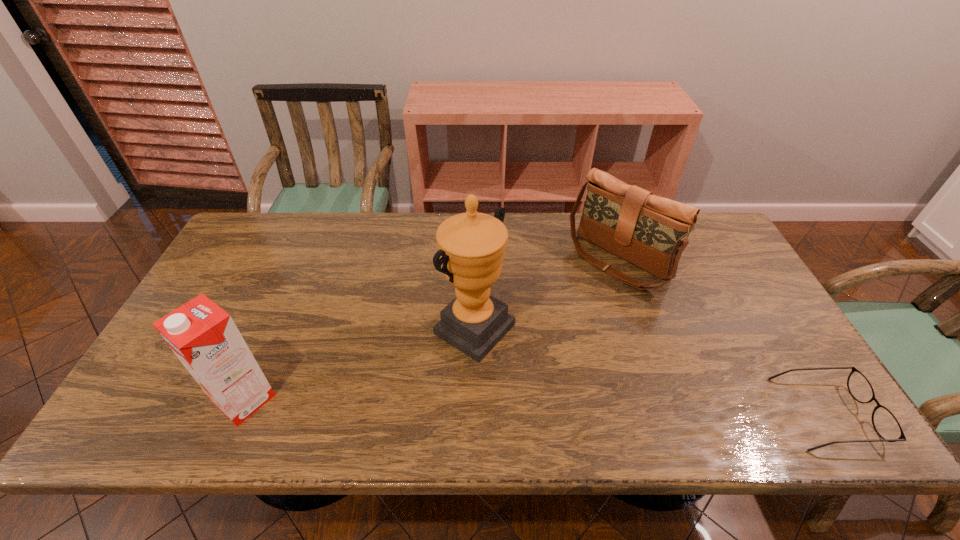
At what (x,y) coordinates should I click in order to perform the action: click on vacant space at the far edge of the desktop. Please return your answer as a coordinate pair (x, y). Image resolution: width=960 pixels, height=540 pixels. Looking at the image, I should click on (538, 246).

Locate an element on the screen. free space at the near edge of the desktop is located at coordinates (345, 375).

Locate an element on the screen. This screenshot has width=960, height=540. free space at the left edge of the desktop is located at coordinates click(243, 303).

Image resolution: width=960 pixels, height=540 pixels. Find the location of `free space at the far right corner`. free space at the far right corner is located at coordinates point(702,234).

Find the location of `vacant area that lies between the spectacles and the third tallest object`. vacant area that lies between the spectacles and the third tallest object is located at coordinates [722, 337].

I want to click on vacant space in between the third object from left to right and the third shortest object, so click(x=432, y=330).

Identify the location of blank region between the carton and the second object from left to right. click(x=360, y=364).

Where is `free spot between the second object from right to left and the rightmost object`? This screenshot has width=960, height=540. free spot between the second object from right to left and the rightmost object is located at coordinates (722, 337).

Image resolution: width=960 pixels, height=540 pixels. In order to click on vacant region between the award and the second shortest object in this screenshot , I will do `click(546, 295)`.

Locate an element on the screen. unoccupied position between the shortest object and the shoulder bag is located at coordinates (722, 337).